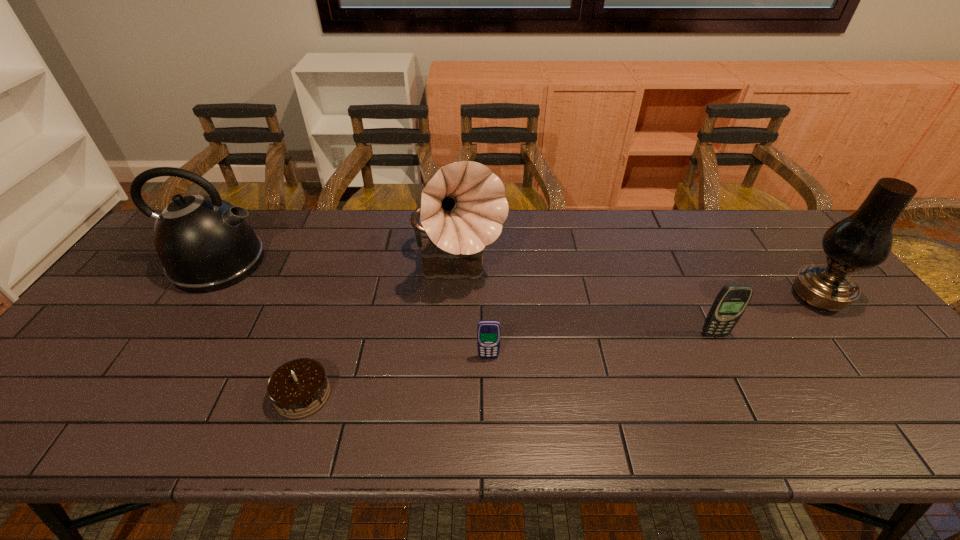
At what (x,y) coordinates should I click in order to perform the action: click on unoccupied position between the leftmost object and the nearer cellular telephone. Please return your answer as a coordinate pair (x, y). Image resolution: width=960 pixels, height=540 pixels. Looking at the image, I should click on (353, 310).

This screenshot has height=540, width=960. In order to click on free point between the chocolate cake and the oil lamp in this screenshot , I will do `click(561, 347)`.

This screenshot has height=540, width=960. In order to click on vacant space that's between the right cellular telephone and the leftmost object in this screenshot , I will do `click(466, 299)`.

At what (x,y) coordinates should I click in order to perform the action: click on empty space that is in between the leftmost object and the fifth object from right to left. Please return your answer as a coordinate pair (x, y). Image resolution: width=960 pixels, height=540 pixels. Looking at the image, I should click on point(260,329).

Identify the location of free area in between the leftmost object and the farther cellular telephone. (466, 299).

Where is `vacant area that lies between the fifth object from right to left and the record player`? The image size is (960, 540). vacant area that lies between the fifth object from right to left and the record player is located at coordinates (381, 333).

Where is `free space between the taller cellular telephone and the nearest object`? The image size is (960, 540). free space between the taller cellular telephone and the nearest object is located at coordinates (509, 364).

Locate an element on the screen. Image resolution: width=960 pixels, height=540 pixels. object that stands as the fifth closest to the nearer cellular telephone is located at coordinates (863, 240).

You are a GUI agent. You are given a task and a screenshot of the screen. Output one action in this format:
    pyautogui.click(x=<x>, y=<y>)
    Task: Click on the object that stands as the third closest to the second object from right to left
    The width and height of the screenshot is (960, 540).
    Given the screenshot: What is the action you would take?
    pyautogui.click(x=488, y=331)

Locate an element on the screen. Image resolution: width=960 pixels, height=540 pixels. vacant space that satisfies the following two spatial constraints: 1. on the spout of the shortest object; 2. on the left side of the leftmost object is located at coordinates (131, 395).